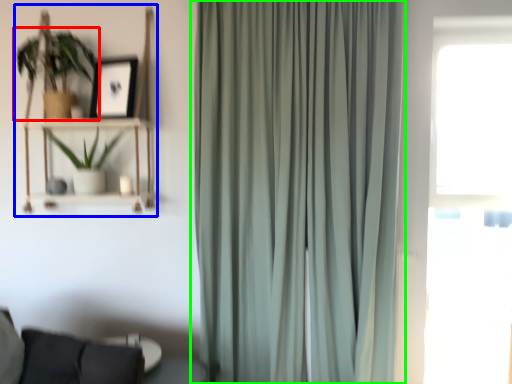
Question: Based on their relative distances, which object is farther from houseplant (highlighted by a red box)? Choose from bookshelf (highlighted by a blue box) and curtain (highlighted by a green box).

Choices:
 (A) bookshelf
 (B) curtain

Answer: (B)